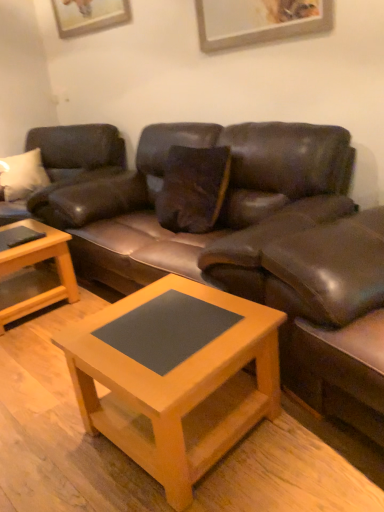
Question: Is leather swivel chair at right facing away from brown leather couch at center, the 1th studio couch from the right?

Choices:
 (A) no
 (B) yes

Answer: (A)

Question: Considering the relative sizes of leather swivel chair at right and brown leather couch at center, which appears as the 2th studio couch when viewed from the left, in the image provided, is leather swivel chair at right taller than brown leather couch at center, which appears as the 2th studio couch when viewed from the left,?

Choices:
 (A) no
 (B) yes

Answer: (A)

Question: Is leather swivel chair at right oriented towards brown leather couch at center, which appears as the 2th studio couch when viewed from the left?

Choices:
 (A) yes
 (B) no

Answer: (B)

Question: Is the depth of leather swivel chair at right greater than that of brown leather couch at center, the 1th studio couch from the right?

Choices:
 (A) no
 (B) yes

Answer: (A)

Question: Is brown leather couch at center, the 1th studio couch from the right, inside leather swivel chair at right?

Choices:
 (A) yes
 (B) no

Answer: (B)

Question: Looking at the image, does light brown wooden coffee table at lower left, which appears as the 1th coffee table when viewed from the back, seem bigger or smaller compared to wooden picture frame at upper center?

Choices:
 (A) big
 (B) small

Answer: (A)

Question: From the image's perspective, is light brown wooden coffee table at lower left, which is the 1th coffee table from left to right, located above or below wooden picture frame at upper center?

Choices:
 (A) below
 (B) above

Answer: (A)

Question: From a real-world perspective, is light brown wooden coffee table at lower left, which is the 1th coffee table from left to right, above or below wooden picture frame at upper center?

Choices:
 (A) below
 (B) above

Answer: (A)

Question: In terms of width, does light brown wooden coffee table at lower left, arranged as the second coffee table when viewed from the front, look wider or thinner when compared to wooden picture frame at upper center?

Choices:
 (A) wide
 (B) thin

Answer: (A)

Question: Is point (46, 305) closer or farther from the camera than point (274, 403)?

Choices:
 (A) closer
 (B) farther

Answer: (B)

Question: Looking at the image, does light brown wooden coffee table at lower left, which is the 1th coffee table from left to right, seem bigger or smaller compared to matte wood coffee table at center, the second coffee table from the back?

Choices:
 (A) big
 (B) small

Answer: (B)

Question: From the image's perspective, is light brown wooden coffee table at lower left, which is the 1th coffee table from left to right, above or below matte wood coffee table at center, the second coffee table viewed from the left?

Choices:
 (A) below
 (B) above

Answer: (B)

Question: Is light brown wooden coffee table at lower left, arranged as the second coffee table when viewed from the front, taller or shorter than matte wood coffee table at center, the first coffee table viewed from the right?

Choices:
 (A) short
 (B) tall

Answer: (A)

Question: Is leather swivel chair at right wider or thinner than matte brown leather couch at left, acting as the second studio couch starting from the right?

Choices:
 (A) thin
 (B) wide

Answer: (A)

Question: Is point (301, 297) closer or farther from the camera than point (49, 158)?

Choices:
 (A) farther
 (B) closer

Answer: (B)